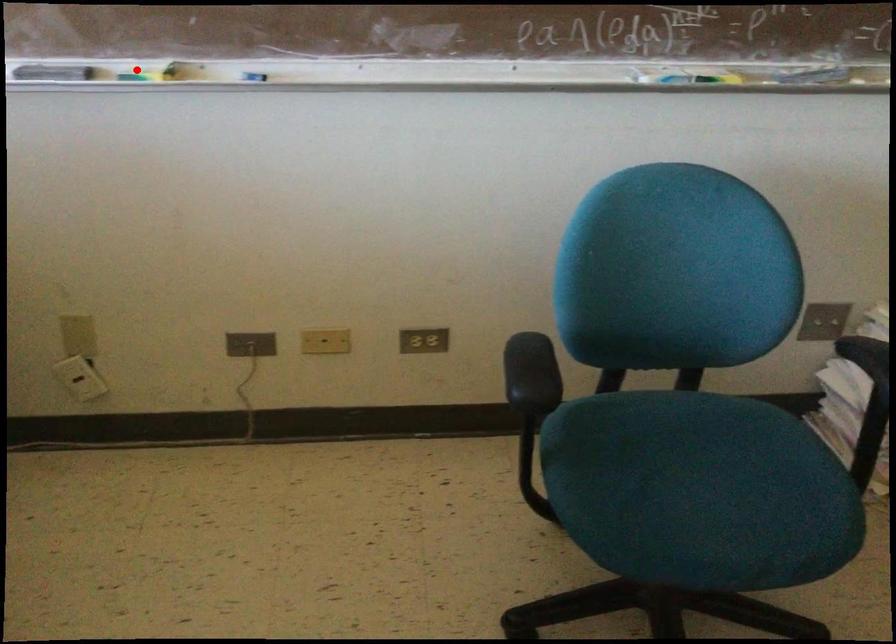
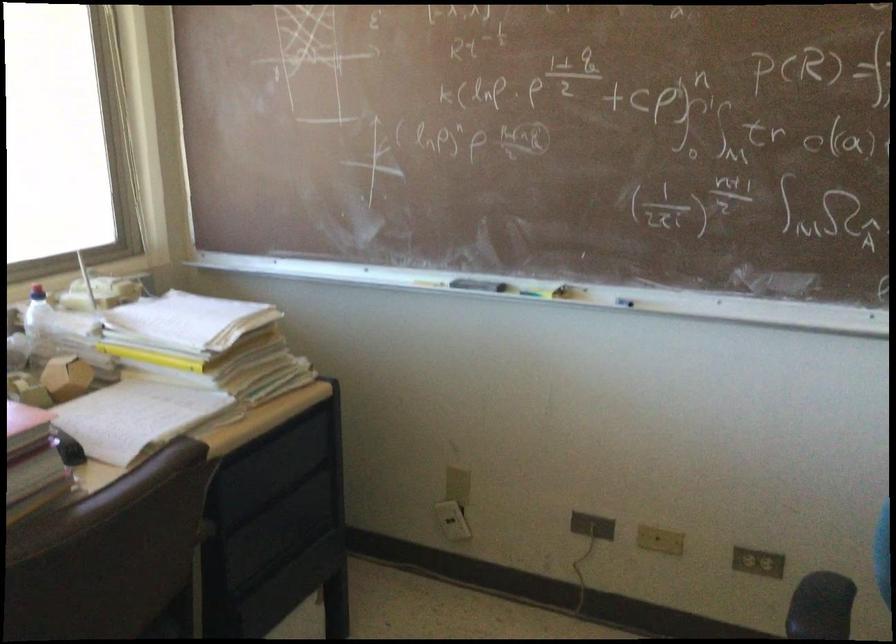
Find the pixel in the second image that matches the highlighted location in the first image.

(538, 289)